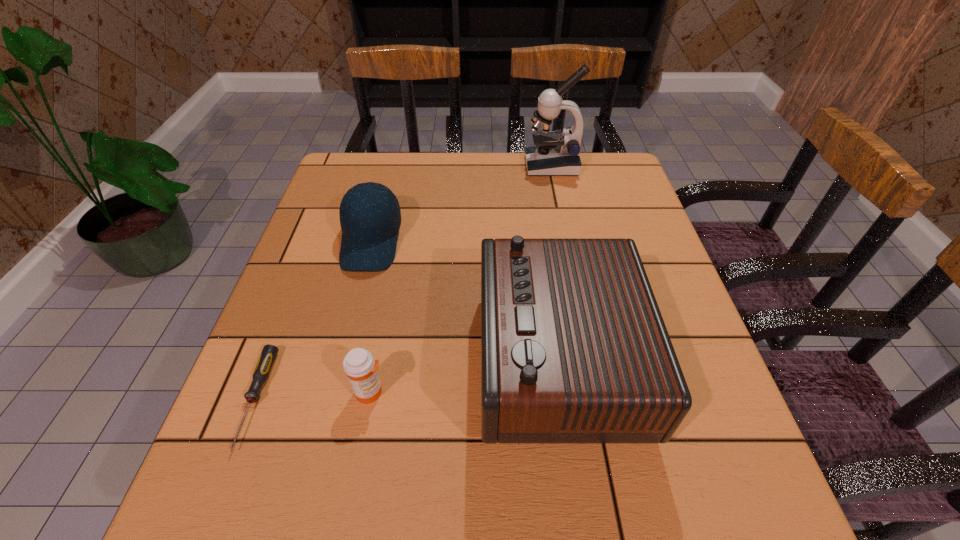
Where is `microscope`? Image resolution: width=960 pixels, height=540 pixels. microscope is located at coordinates (554, 153).

Find the location of `the tallest object`. the tallest object is located at coordinates (554, 153).

You are a GUI agent. You are given a task and a screenshot of the screen. Output one action in this format:
    pyautogui.click(x=<x>, y=<y>)
    Task: Click on the second tallest object
    Image resolution: width=960 pixels, height=540 pixels.
    Given the screenshot: What is the action you would take?
    (574, 350)

This screenshot has height=540, width=960. Find the location of `the third shortest object`. the third shortest object is located at coordinates (370, 217).

Where is `baseball cap`? This screenshot has height=540, width=960. baseball cap is located at coordinates (370, 217).

Where is `the second shortest object`? The height and width of the screenshot is (540, 960). the second shortest object is located at coordinates (359, 365).

This screenshot has height=540, width=960. Find the location of `the shortest object`. the shortest object is located at coordinates (268, 355).

The height and width of the screenshot is (540, 960). I want to click on the leftmost object, so pyautogui.click(x=268, y=355).

Identify the location of free location located 0.170m at the eyepiece of the microscope. (468, 166).

This screenshot has width=960, height=540. I want to click on free spot located at the eyepiece of the microscope, so click(x=472, y=166).